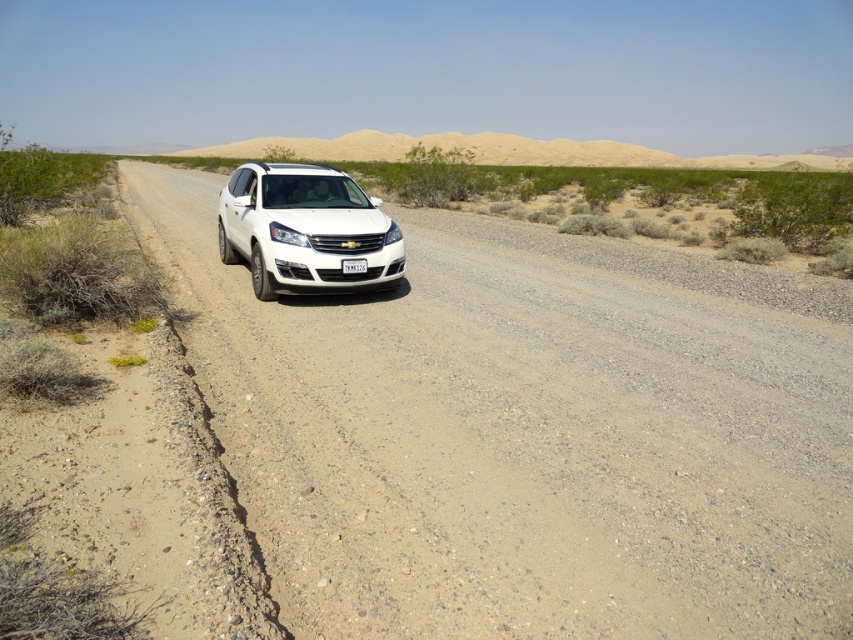
Between white gravel road at center and white plastic license plate at center, which one is positioned lower?

white plastic license plate at center is below.

Does point (303, 371) come farther from viewer compared to point (364, 272)?

No.

Which is behind, point (724, 529) or point (347, 268)?

Point (347, 268)

The height and width of the screenshot is (640, 853). Find the location of `white gravel road at center`. white gravel road at center is located at coordinates (523, 442).

Does white gravel road at center lie in front of white glossy suv at center?

Yes, white gravel road at center is closer to the viewer.

Is point (190, 211) closer to viewer compared to point (368, 260)?

No, it is not.

Image resolution: width=853 pixels, height=640 pixels. Find the location of `white gravel road at center`. white gravel road at center is located at coordinates click(x=523, y=442).

Which is more to the right, white glossy suv at center or white plastic license plate at center?

white plastic license plate at center is more to the right.

Is point (306, 195) farther from viewer compared to point (355, 259)?

Yes, point (306, 195) is farther from viewer.

Find the location of a particular element. This screenshot has height=640, width=853. white glossy suv at center is located at coordinates (305, 230).

The width and height of the screenshot is (853, 640). In order to click on white glossy suv at center in this screenshot , I will do `click(305, 230)`.